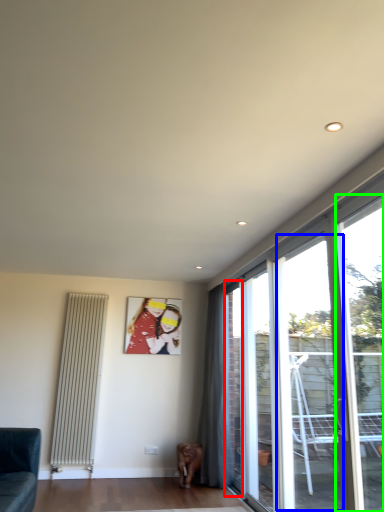
Question: Which is farther away from window (highlighted by a red box)? window (highlighted by a blue box) or window (highlighted by a green box)?

Choices:
 (A) window
 (B) window

Answer: (B)